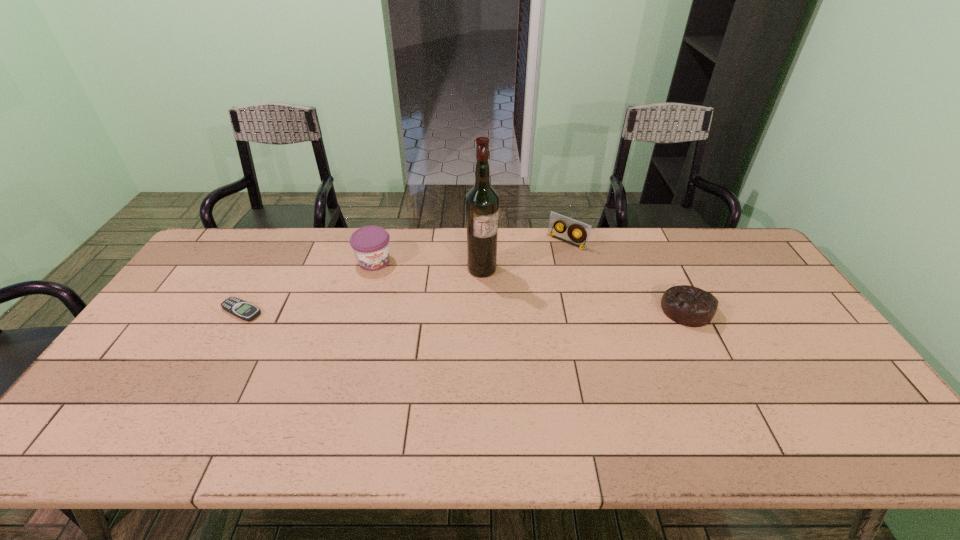
In order to click on free location located 0.070m on the front and back of the wine bottle in this screenshot , I will do pos(505,289).

Image resolution: width=960 pixels, height=540 pixels. I want to click on free region located 0.310m on the front and back of the wine bottle, so click(x=560, y=336).

At what (x,y) coordinates should I click in order to perform the action: click on free location located 0.250m on the front and back of the wine bottle. Please return your answer as a coordinate pair (x, y). The image size is (960, 540). Looking at the image, I should click on (544, 323).

Locate an element on the screen. Image resolution: width=960 pixels, height=540 pixels. vacant space located 0.070m at the front of the videotape with visible reels is located at coordinates (547, 259).

Where is `vacant position located 0.070m at the front of the videotape with visible reels`? The width and height of the screenshot is (960, 540). vacant position located 0.070m at the front of the videotape with visible reels is located at coordinates (547, 259).

Where is `vacant area situated 0.230m at the front of the videotape with visible reels`? vacant area situated 0.230m at the front of the videotape with visible reels is located at coordinates (521, 285).

Where is `vacant region located 0.210m on the front label of the jam`? vacant region located 0.210m on the front label of the jam is located at coordinates (401, 314).

Find the location of `vacant space located on the front label of the jam`. vacant space located on the front label of the jam is located at coordinates (397, 307).

At what (x,y) coordinates should I click in order to perform the action: click on free space located 0.310m on the front label of the jam. Please return your answer as a coordinate pair (x, y). The image size is (960, 540). Looking at the image, I should click on (413, 337).

Image resolution: width=960 pixels, height=540 pixels. I want to click on wine bottle that is at the far edge, so click(482, 202).